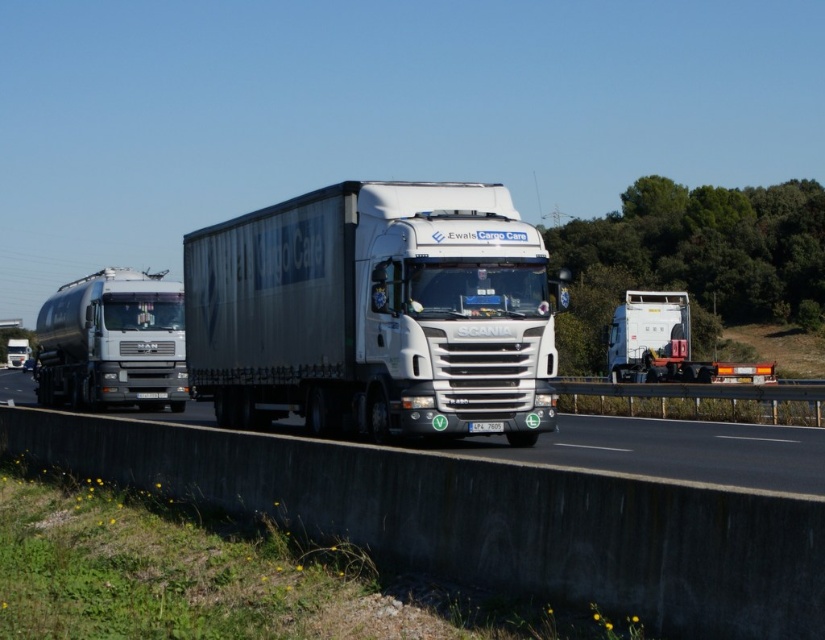
Question: Can you confirm if white matte trailer truck at center is wider than white glossy trailer at right?

Choices:
 (A) yes
 (B) no

Answer: (B)

Question: Can you confirm if concrete at center is positioned below white glossy trailer at right?

Choices:
 (A) yes
 (B) no

Answer: (A)

Question: Does concrete at center have a lesser width compared to white glossy truck at center?

Choices:
 (A) no
 (B) yes

Answer: (B)

Question: Among these objects, which one is farthest from the camera?

Choices:
 (A) white glossy trailer at right
 (B) metallic silver tanker at left
 (C) white matte trailer truck at center
 (D) concrete at center

Answer: (A)

Question: Which object is farther from the camera taking this photo?

Choices:
 (A) concrete at center
 (B) white glossy trailer at right

Answer: (B)

Question: Considering the real-world distances, which object is farthest from the white matte trailer truck at center?

Choices:
 (A) concrete at center
 (B) metallic silver tanker at left

Answer: (B)